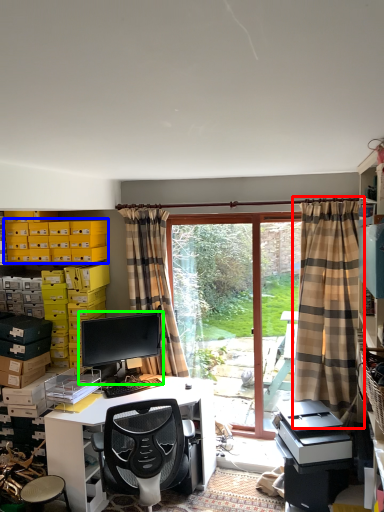
Question: Which object is the farthest from curtain (highlighted by a red box)? Choose among these: storage box (highlighted by a blue box) or computer monitor (highlighted by a green box).

Choices:
 (A) storage box
 (B) computer monitor

Answer: (A)